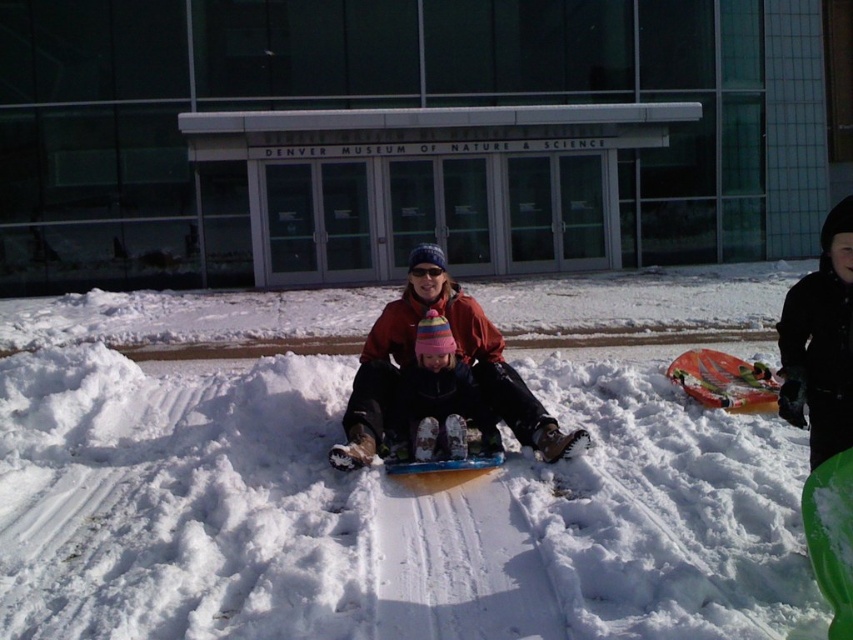
Based on the photo, who is more forward, (374, 426) or (844, 464)?

Point (844, 464)

Is point (525, 442) positioned behind point (817, 531)?

That is True.

At what (x,y) coordinates should I click in order to perform the action: click on matte red snowboard at center. Please return your answer as a coordinate pair (x, y). The image size is (853, 640). Looking at the image, I should click on pos(456,356).

Is the position of white fluffy snow at center less distant than that of orange plastic snowboard at center?

Yes, white fluffy snow at center is in front of orange plastic snowboard at center.

Between point (10, 452) and point (722, 371), which one is positioned in front?

Point (10, 452) is in front.

Who is more distant from viewer, (277, 420) or (706, 401)?

The point (706, 401) is more distant.

Identify the location of white fluffy snow at center. The width and height of the screenshot is (853, 640). (370, 493).

Which is above, green plastic snowboard at lower right or orange plastic snowboard at center?

Positioned higher is orange plastic snowboard at center.

Does green plastic snowboard at lower right lie in front of orange plastic snowboard at center?

Yes, it is in front of orange plastic snowboard at center.

Which is behind, point (807, 544) or point (769, 394)?

The point (769, 394) is behind.

You are a GUI agent. You are given a task and a screenshot of the screen. Output one action in this format:
    pyautogui.click(x=<x>, y=<y>)
    Task: Click on the green plastic snowboard at lower right
    The height and width of the screenshot is (640, 853).
    Given the screenshot: What is the action you would take?
    pyautogui.click(x=831, y=536)